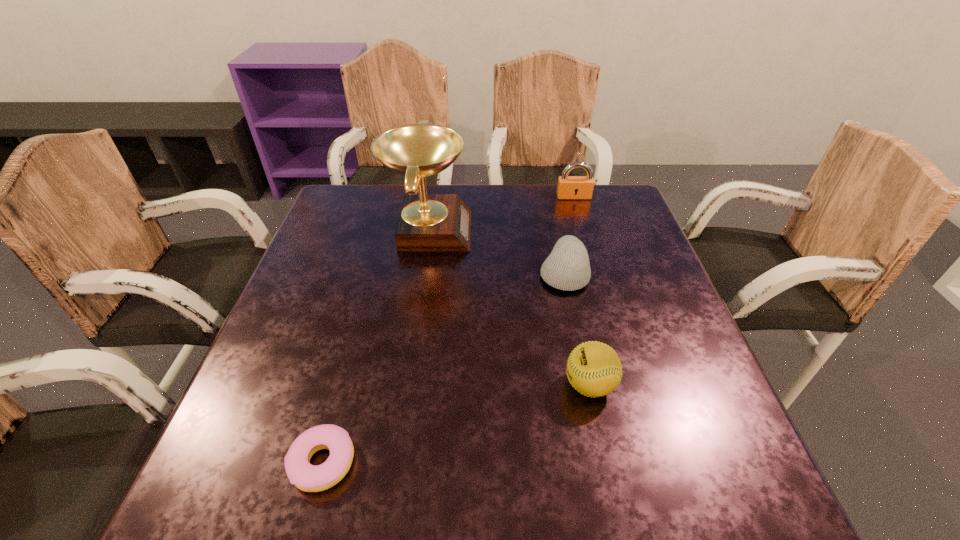
I want to click on vacant area situated on the logo side of the softball, so pyautogui.click(x=375, y=385).

Where is `free space located 0.110m on the right of the beanie`? The width and height of the screenshot is (960, 540). free space located 0.110m on the right of the beanie is located at coordinates (633, 273).

I want to click on vacant space located on the right of the doughnut, so click(x=542, y=462).

At what (x,y) coordinates should I click in order to perform the action: click on award located at the far edge. Please return your answer as a coordinate pair (x, y). Looking at the image, I should click on [427, 222].

Find the location of `padlock that is positioned at the far edge`. padlock that is positioned at the far edge is located at coordinates pos(569,187).

This screenshot has width=960, height=540. What are the coordinates of `object located at the near edge` in the screenshot? It's located at (310, 478).

This screenshot has width=960, height=540. I want to click on object present at the left edge, so click(x=310, y=478).

Locate an element on the screen. The height and width of the screenshot is (540, 960). object that is at the right edge is located at coordinates (569, 187).

Find the location of a particular element. Image resolution: width=960 pixels, height=540 pixels. object that is at the near left corner is located at coordinates (310, 478).

Identify the location of object that is at the far right corner. This screenshot has height=540, width=960. (569, 187).